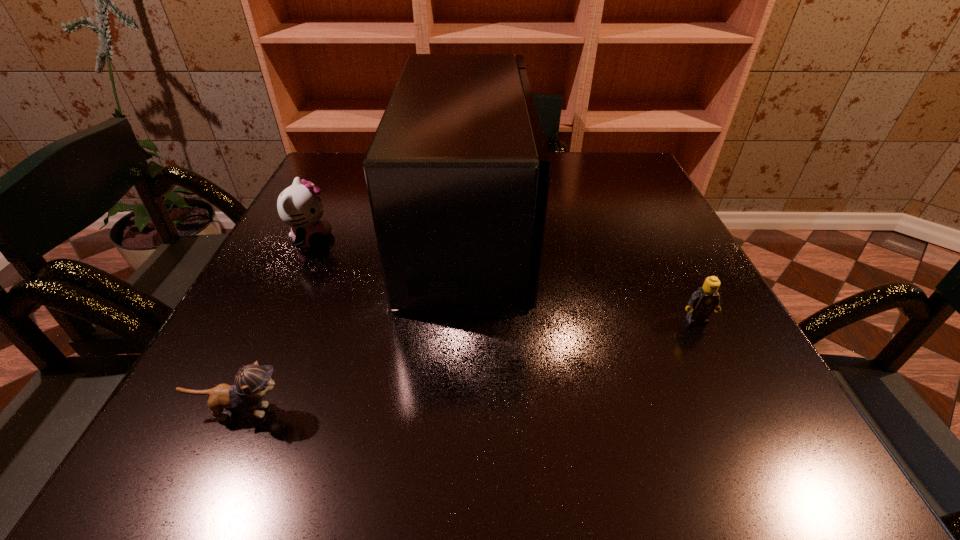
I want to click on empty space between the nearer kitten and the Lego, so click(x=468, y=366).

Locate an element on the screen. The width and height of the screenshot is (960, 540). blank region between the Lego and the nearer kitten is located at coordinates (468, 366).

Image resolution: width=960 pixels, height=540 pixels. I want to click on free area in between the nearest object and the farther kitten, so click(276, 326).

At what (x,y) coordinates should I click in order to perform the action: click on object that is the closest to the third object from left to right. Please return your answer as a coordinate pair (x, y). The width and height of the screenshot is (960, 540). Looking at the image, I should click on (298, 206).

Identify which object is located as the second nearest to the microwave_oven. Please provide its 2D coordinates. Your answer should be formatted as a tuple, i.e. [(x, y)], where the tuple contains the x and y coordinates of a point satisfying the conditions above.

[(252, 382)]